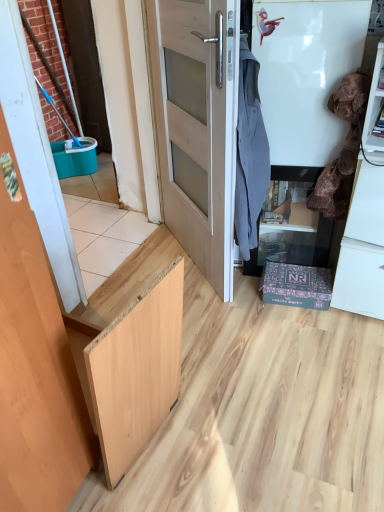
Question: Is light wood door at center, which appears as the second door when viewed from the front, situated inside wooden door at left, the 2th door from the back, or outside?

Choices:
 (A) outside
 (B) inside

Answer: (A)

Question: Based on their positions, is light wood door at center, which is counted as the 2th door, starting from the left, located to the left or right of wooden door at left, which is counted as the first door, starting from the left?

Choices:
 (A) left
 (B) right

Answer: (B)

Question: Which of these objects is positioned closest to the velvet brown laundry at right, marked as the 2th laundry in a left-to-right arrangement?

Choices:
 (A) gray fabric shirt at upper right, acting as the 1th laundry starting from the left
 (B) light wood door at center, which is counted as the 2th door, starting from the left
 (C) wooden door at left, acting as the 1th door starting from the front
 (D) matte black cabinet at lower right

Answer: (D)

Question: Which of these objects is positioned farthest from the wooden door at left, which is counted as the first door, starting from the left?

Choices:
 (A) light wood door at center, the 1th door viewed from the right
 (B) gray fabric shirt at upper right, acting as the 1th laundry starting from the left
 (C) velvet brown laundry at right, marked as the 2th laundry in a left-to-right arrangement
 (D) matte black cabinet at lower right

Answer: (D)